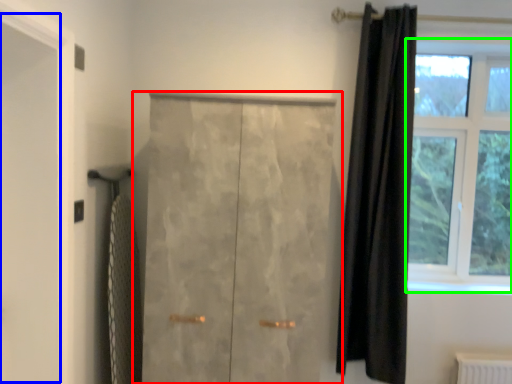
Question: Which object is positioned farthest from door (highlighted by a red box)? Select from screen door (highlighted by a blue box) and window (highlighted by a green box).

Choices:
 (A) screen door
 (B) window

Answer: (B)